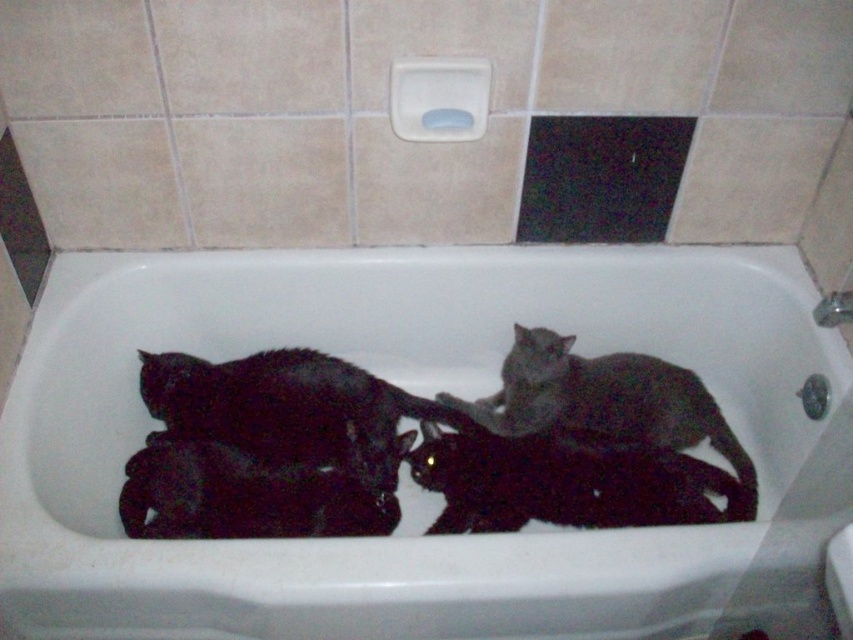
Question: Which object is farther from the camera taking this photo?

Choices:
 (A) white glossy bathtub at center
 (B) black matte cat at lower left

Answer: (B)

Question: Is black matte cat at center bigger than black matte cat at lower left?

Choices:
 (A) yes
 (B) no

Answer: (A)

Question: Among these objects, which one is nearest to the camera?

Choices:
 (A) black matte cat at center
 (B) shiny black cat at center
 (C) black matte cat at lower left

Answer: (C)

Question: Among these objects, which one is farthest from the camera?

Choices:
 (A) black matte cat at lower left
 (B) gray matte cat at center

Answer: (B)

Question: Can you confirm if black matte cat at center is thinner than gray matte cat at center?

Choices:
 (A) yes
 (B) no

Answer: (B)

Question: Observing the image, what is the correct spatial positioning of white glossy bathtub at center in reference to black matte cat at center?

Choices:
 (A) below
 (B) above

Answer: (B)